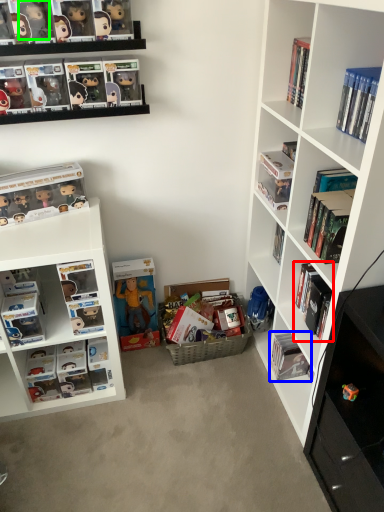
Question: Which object is the farthest from book (highlighted by a red box)? Choose among these: book (highlighted by a blue box) or toy (highlighted by a green box).

Choices:
 (A) book
 (B) toy

Answer: (B)